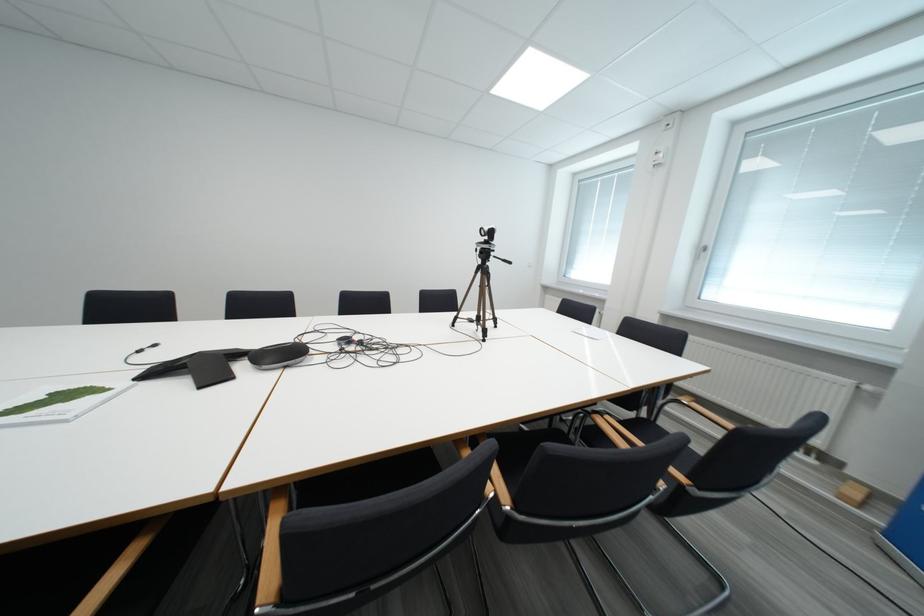
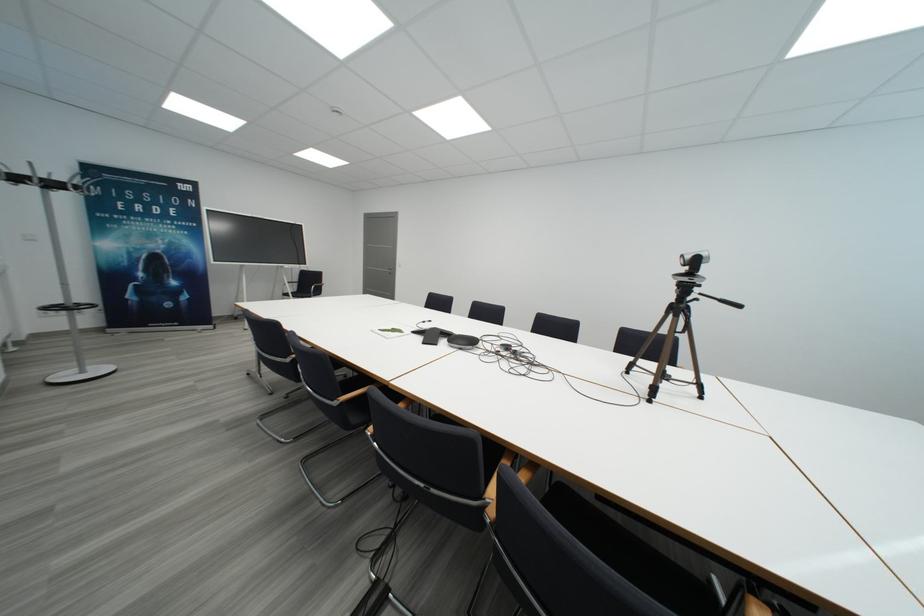
Question: I am providing you with two images of the same scene from different viewpoints. After the viewpoint changes to image2, which objects are now occluded?

Choices:
 (A) black chair armrest
 (B) coat stand hook
 (C) wooden chair armrest
 (D) none of these

Answer: (D)